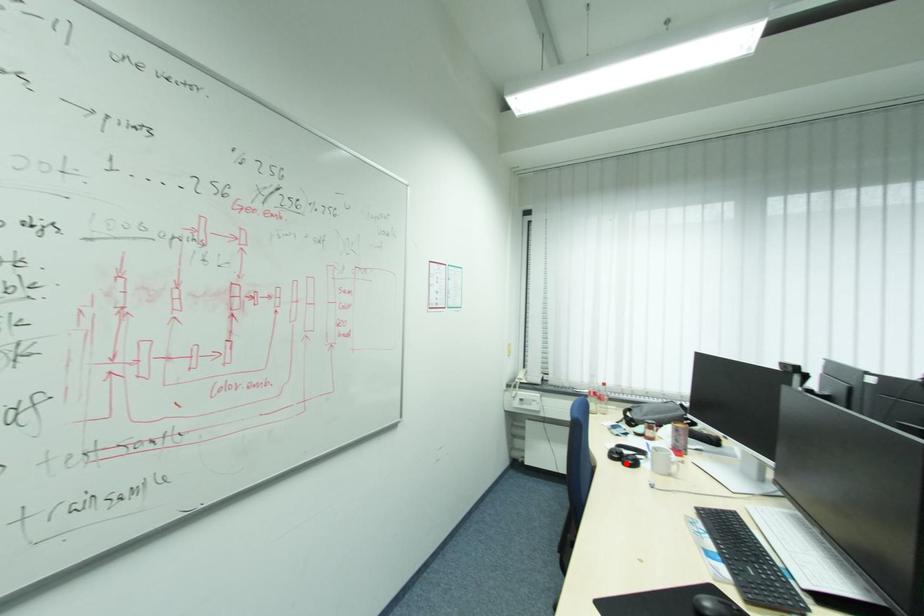
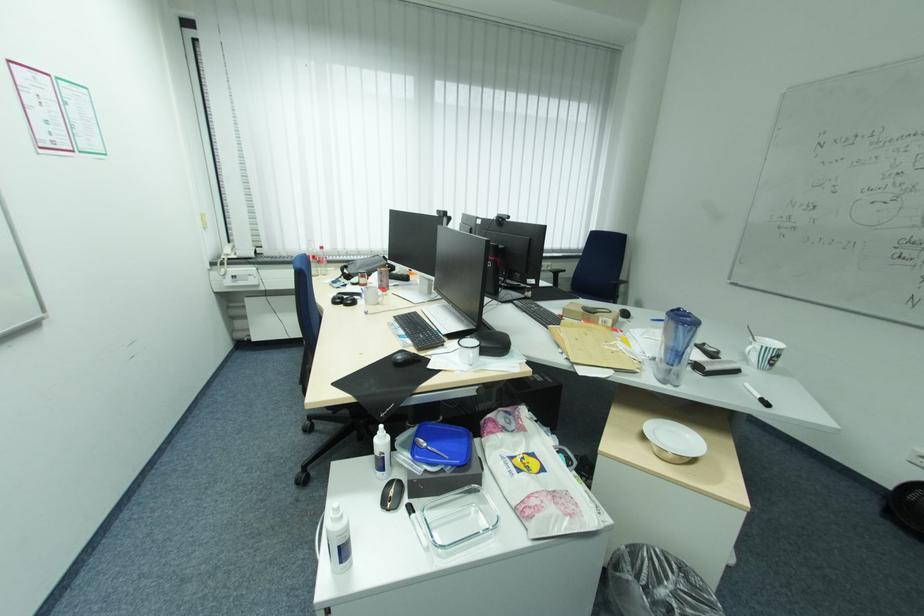
The point at the highlighted location is marked in the first image. Where is the corresponding point in the second image?

(348, 305)